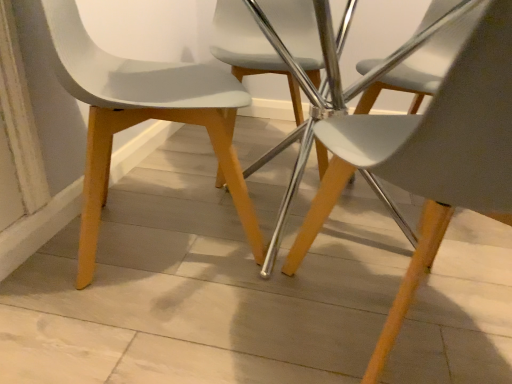
Find the location of a particular element. The image size is (512, 384). free point in front of matte white chair at left, arranged as the second chair when viewed from the front is located at coordinates (130, 330).